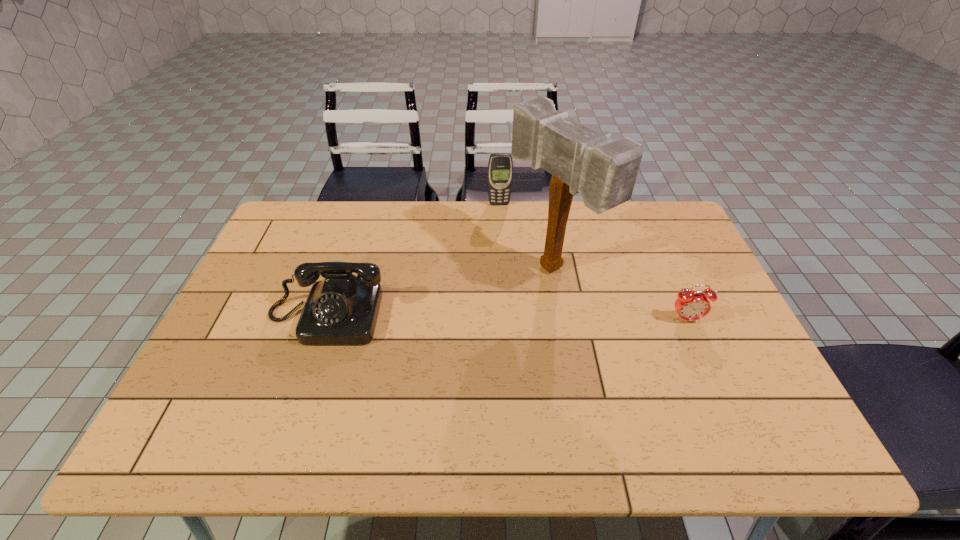
Identify the location of the leftmost object. (342, 309).

The height and width of the screenshot is (540, 960). Identify the location of the rightmost object. (690, 306).

You are a GUI agent. You are given a task and a screenshot of the screen. Output one action in this format:
    pyautogui.click(x=<x>, y=<y>)
    Task: Click on the shortest object
    The image size is (960, 540).
    Given the screenshot: What is the action you would take?
    pyautogui.click(x=690, y=306)

The width and height of the screenshot is (960, 540). I want to click on the second tallest object, so click(500, 166).

The height and width of the screenshot is (540, 960). What are the coordinates of `cellular telephone` in the screenshot? It's located at (500, 166).

Locate an element on the screen. Image resolution: width=960 pixels, height=540 pixels. mallet is located at coordinates (604, 171).

Where is `vacant space located on the dial of the telephone`? The width and height of the screenshot is (960, 540). vacant space located on the dial of the telephone is located at coordinates (301, 391).

At what (x,y) coordinates should I click in order to perform the action: click on free region located 0.140m on the face of the shortest object. Please return your answer as a coordinate pair (x, y). Looking at the image, I should click on (708, 369).

Where is `vacant space located 0.110m on the screen of the farthest object`? The image size is (960, 540). vacant space located 0.110m on the screen of the farthest object is located at coordinates (503, 225).

This screenshot has height=540, width=960. I want to click on free space located on the screen of the farthest object, so (506, 249).